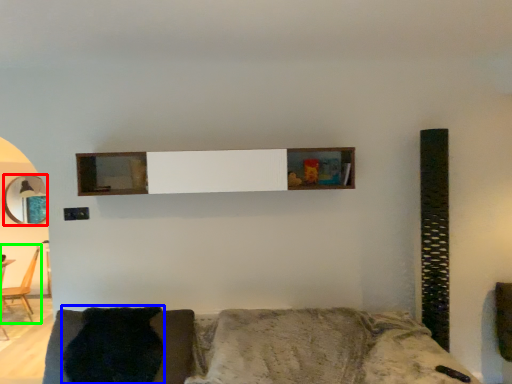
Question: Which object is the closest to the mirror (highlighted by a red box)? Choose among these: pillow (highlighted by a blue box) or chair (highlighted by a green box).

Choices:
 (A) pillow
 (B) chair

Answer: (B)